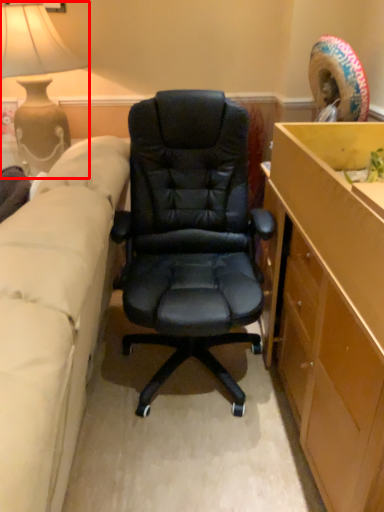
Question: From the image's perspective, what is the correct spatial relationship of lamp (annotated by the red box) in relation to studio couch?

Choices:
 (A) above
 (B) below

Answer: (A)